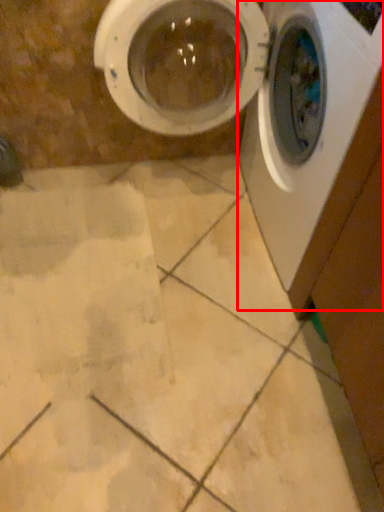
Question: In this image, where is washing machine (annotated by the red box) located relative to washing machine?

Choices:
 (A) right
 (B) left

Answer: (A)